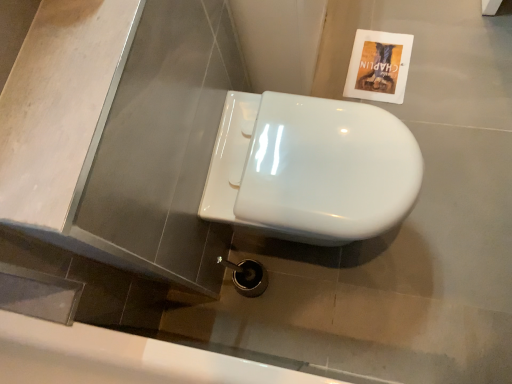
Find the location of `vacant point above white glossy toilet at center (from a real-world perspective)`. vacant point above white glossy toilet at center (from a real-world perspective) is located at coordinates (315, 159).